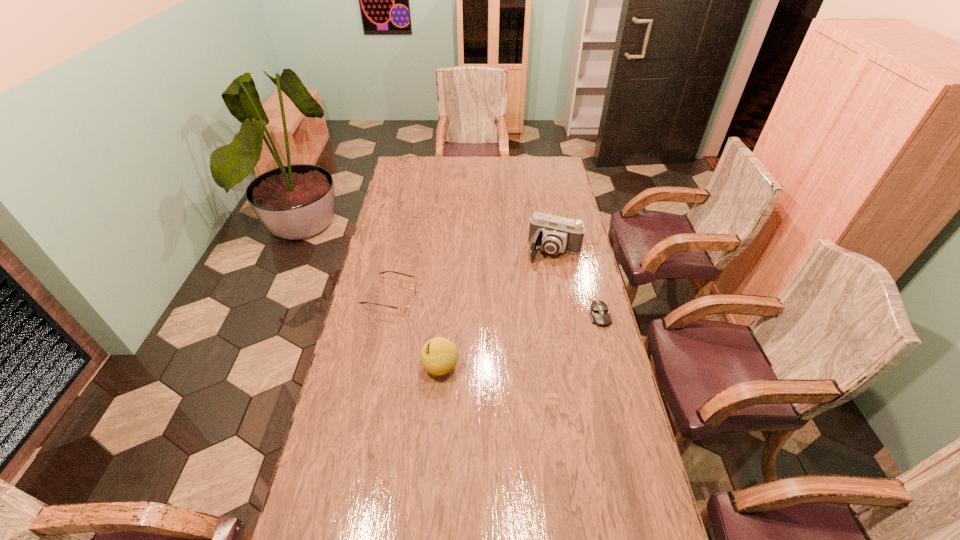
Find the location of a particular element. The width and height of the screenshot is (960, 540). vacant space on the desktop that is between the third shortest object and the shortest object and is positioned at the front of the tallest object with an open lens cover is located at coordinates (521, 341).

The width and height of the screenshot is (960, 540). I want to click on vacant space on the desktop that is between the third shortest object and the shortest object and is positioned on the front-facing side of the spectacles, so click(x=546, y=333).